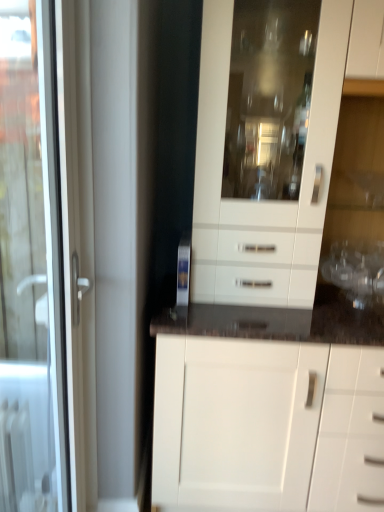
Question: In terms of width, does white glossy cabinet at center look wider or thinner when compared to white glossy door at left?

Choices:
 (A) thin
 (B) wide

Answer: (B)

Question: From their relative heights in the image, would you say white glossy cabinet at center is taller or shorter than white glossy door at left?

Choices:
 (A) short
 (B) tall

Answer: (B)

Question: Based on their sizes in the image, would you say white glossy cabinet at center is bigger or smaller than white glossy door at left?

Choices:
 (A) small
 (B) big

Answer: (B)

Question: Is white glossy door at left bigger or smaller than white glossy cabinet at center?

Choices:
 (A) small
 (B) big

Answer: (A)

Question: From a real-world perspective, is white glossy door at left physically located above or below white glossy cabinet at center?

Choices:
 (A) below
 (B) above

Answer: (A)

Question: Is white glossy door at left inside the boundaries of white glossy cabinet at center, or outside?

Choices:
 (A) outside
 (B) inside

Answer: (A)

Question: Considering their positions, is white glossy door at left located in front of or behind white glossy cabinet at center?

Choices:
 (A) behind
 (B) front

Answer: (B)